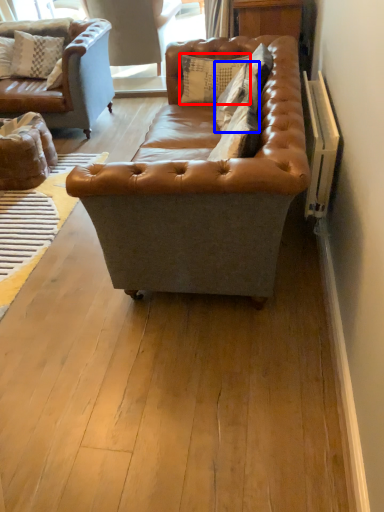
Question: Which object appears closest to the camera in this image, pillow (highlighted by a red box) or pillow (highlighted by a blue box)?

Choices:
 (A) pillow
 (B) pillow

Answer: (B)